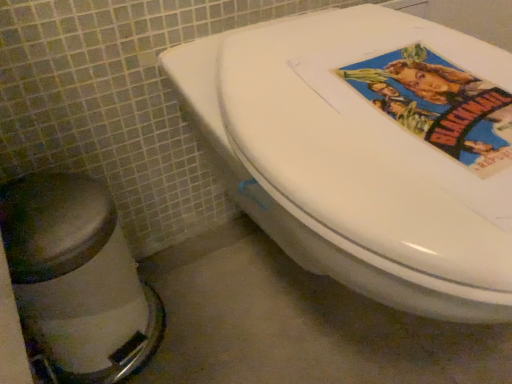
Question: From a real-world perspective, is white glossy toilet at center physically located above or below brushed metal bidet at lower left?

Choices:
 (A) above
 (B) below

Answer: (A)

Question: From the image's perspective, is white glossy toilet at center located above or below brushed metal bidet at lower left?

Choices:
 (A) below
 (B) above

Answer: (B)

Question: Looking at their shapes, would you say white glossy toilet at center is wider or thinner than brushed metal bidet at lower left?

Choices:
 (A) wide
 (B) thin

Answer: (A)

Question: Considering the positions of brushed metal bidet at lower left and white glossy toilet at center in the image, is brushed metal bidet at lower left bigger or smaller than white glossy toilet at center?

Choices:
 (A) small
 (B) big

Answer: (A)

Question: In the image, is brushed metal bidet at lower left positioned in front of or behind white glossy toilet at center?

Choices:
 (A) front
 (B) behind

Answer: (B)

Question: In terms of height, does brushed metal bidet at lower left look taller or shorter compared to white glossy toilet at center?

Choices:
 (A) tall
 (B) short

Answer: (B)

Question: Considering the positions of brushed metal bidet at lower left and white glossy toilet at center in the image, is brushed metal bidet at lower left wider or thinner than white glossy toilet at center?

Choices:
 (A) thin
 (B) wide

Answer: (A)